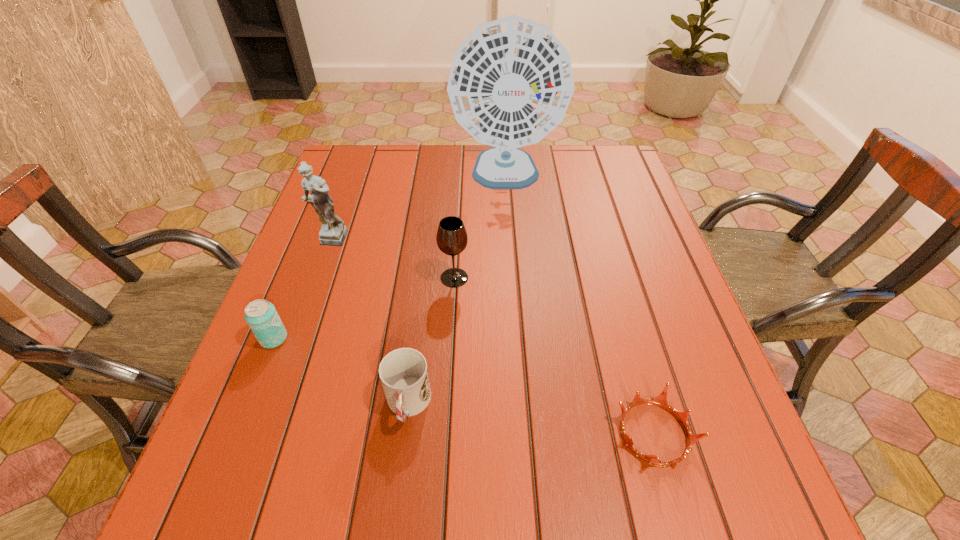
Identify the location of vacant area that lies between the farthest object and the cup. This screenshot has width=960, height=540. (457, 291).

Identify the location of free point between the tallest object and the figurine. (418, 208).

Where is `blank region between the beer can and the figurine`? This screenshot has height=540, width=960. blank region between the beer can and the figurine is located at coordinates (301, 289).

You are a GUI agent. You are given a task and a screenshot of the screen. Output one action in this format:
    pyautogui.click(x=<x>, y=<y>)
    Task: Click on the free area in between the beer can and the fifth nearest object
    
    Given the screenshot: What is the action you would take?
    (301, 289)

I want to click on empty space between the shortest object and the second farthest object, so tap(492, 337).

Choose which object is the second nearest neighbor to the figurine. Please provide its 2D coordinates. Your answer should be formatted as a tuple, i.e. [(x, y)], where the tuple contains the x and y coordinates of a point satisfying the conditions above.

[(452, 239)]

Choose which object is the second nearest neighbor to the figurine. Please provide its 2D coordinates. Your answer should be formatted as a tuple, i.e. [(x, y)], where the tuple contains the x and y coordinates of a point satisfying the conditions above.

[(452, 239)]

Locate an element on the screen. This screenshot has height=540, width=960. free space that satisfies the following two spatial constraints: 1. on the front-facing side of the crown; 2. on the right side of the second tallest object is located at coordinates (260, 434).

The height and width of the screenshot is (540, 960). Find the location of `vacant space that satisfies the following two spatial constraints: 1. on the front-facing side of the second tallest object; 2. on the left side of the fourth shortest object`. vacant space that satisfies the following two spatial constraints: 1. on the front-facing side of the second tallest object; 2. on the left side of the fourth shortest object is located at coordinates (316, 278).

Where is `vacant space that satisfies the following two spatial constraints: 1. on the front side of the wineglass; 2. on the left side of the shortest object`? This screenshot has height=540, width=960. vacant space that satisfies the following two spatial constraints: 1. on the front side of the wineglass; 2. on the left side of the shortest object is located at coordinates (445, 434).